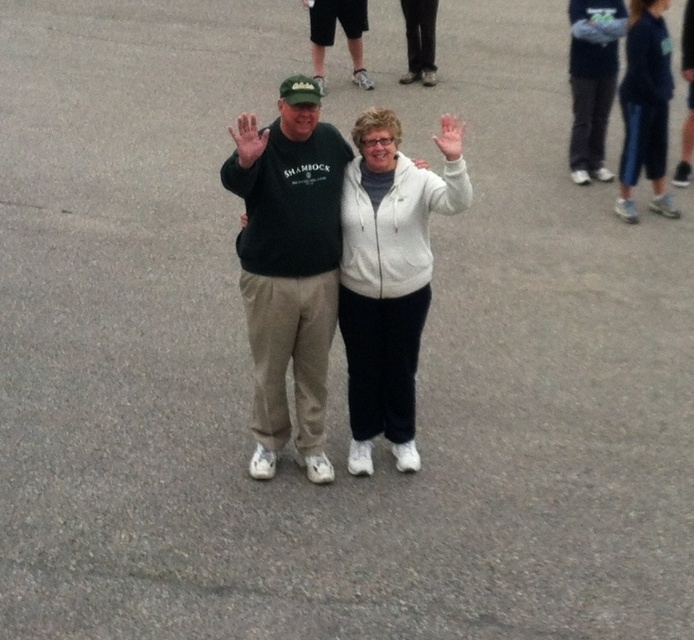
Is white fleece jacket at center in front of blue fleece sweatshirt at right?

Yes, it is.

Can you confirm if white fleece jacket at center is positioned above blue fleece sweatshirt at right?

Actually, white fleece jacket at center is below blue fleece sweatshirt at right.

What are the coordinates of `white fleece jacket at center` in the screenshot? It's located at (389, 276).

Who is shorter, dark green sweatshirt at center or blue fleece sweatshirt at right?

Standing shorter between the two is blue fleece sweatshirt at right.

Is dark green sweatshirt at center closer to the viewer compared to blue fleece sweatshirt at right?

Yes, it is in front of blue fleece sweatshirt at right.

Identify the location of dark green sweatshirt at center. The width and height of the screenshot is (694, 640). (287, 266).

At what (x,y) coordinates should I click in order to perform the action: click on dark green sweatshirt at center. Please return your answer as a coordinate pair (x, y). Image resolution: width=694 pixels, height=640 pixels. Looking at the image, I should click on (287, 266).

Does dark green sweatshirt at center have a lesser height compared to white fleece jacket at center?

Incorrect, dark green sweatshirt at center's height does not fall short of white fleece jacket at center's.

Is dark green sweatshirt at center smaller than white fleece jacket at center?

Actually, dark green sweatshirt at center might be larger than white fleece jacket at center.

Between point (280, 243) and point (448, 182), which one is positioned behind?

The point (280, 243) is behind.

Locate an element on the screen. This screenshot has width=694, height=640. dark green sweatshirt at center is located at coordinates (287, 266).